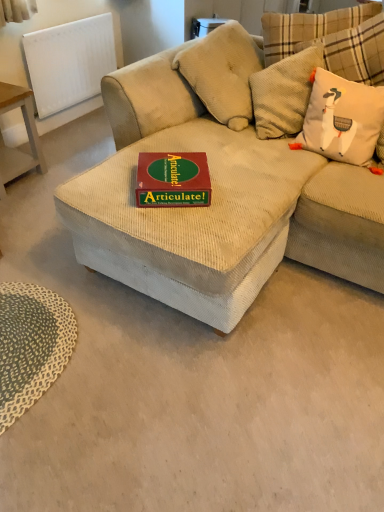
You are a GUI agent. You are given a task and a screenshot of the screen. Output one action in this format:
    pyautogui.click(x=<x>, y=<y>)
    Task: Click on the white textured radiator at upper left
    Image resolution: width=384 pixels, height=512 pixels.
    Given the screenshot: What is the action you would take?
    pyautogui.click(x=69, y=62)

What do you see at coordinates (173, 180) in the screenshot?
I see `green matte board game at center` at bounding box center [173, 180].

Where is `white textured radiator at upper left`? white textured radiator at upper left is located at coordinates (69, 62).

Is white corduroy throw pillow at upper right at the right side of wooden table at left?

Correct, you'll find white corduroy throw pillow at upper right to the right of wooden table at left.

Could you tell me if white corduroy throw pillow at upper right is turned towards wooden table at left?

No, white corduroy throw pillow at upper right is not facing towards wooden table at left.

Considering the relative sizes of white corduroy throw pillow at upper right and wooden table at left in the image provided, is white corduroy throw pillow at upper right wider than wooden table at left?

In fact, white corduroy throw pillow at upper right might be narrower than wooden table at left.

Is white corduroy throw pillow at upper right positioned beyond the bounds of wooden table at left?

Yes.

Looking at this image, from a real-world perspective, which is physically above, green matte board game at center or white textured radiator at upper left?

green matte board game at center, from a real-world perspective.

Which of these two, green matte board game at center or white textured radiator at upper left, is bigger?

white textured radiator at upper left.

Is green matte board game at center turned away from white textured radiator at upper left?

Absolutely, green matte board game at center is directed away from white textured radiator at upper left.

Is white textured radiator at upper left directly adjacent to beige corduroy couch at center?

white textured radiator at upper left and beige corduroy couch at center are clearly separated.

Considering the positions of objects white textured radiator at upper left and beige corduroy couch at center in the image provided, who is more to the right, white textured radiator at upper left or beige corduroy couch at center?

Positioned to the right is beige corduroy couch at center.

Can you confirm if white textured radiator at upper left is thinner than beige corduroy couch at center?

Yes, white textured radiator at upper left is thinner than beige corduroy couch at center.

Who is taller, white textured radiator at upper left or beige corduroy couch at center?

With more height is beige corduroy couch at center.

From a real-world perspective, is green textured mat at lower left over white corduroy throw pillow at upper right?

No, from a real-world perspective, green textured mat at lower left is not above white corduroy throw pillow at upper right.

Is green textured mat at lower left beside white corduroy throw pillow at upper right?

No.

This screenshot has width=384, height=512. What are the coordinates of `throw pillow above the green textured mat at lower left (from a real-world perspective)` in the screenshot? It's located at (342, 119).

Looking at this image, is green textured mat at lower left at the right side of white corduroy throw pillow at upper right?

No.

Is the surface of beige corduroy couch at center in direct contact with green textured mat at lower left?

beige corduroy couch at center and green textured mat at lower left are clearly separated.

Which is correct: beige corduroy couch at center is inside green textured mat at lower left, or outside of it?

The correct answer is: outside.

Does beige corduroy couch at center appear on the right side of green textured mat at lower left?

Correct, you'll find beige corduroy couch at center to the right of green textured mat at lower left.

Does wooden table at left touch green textured mat at lower left?

No, wooden table at left is not with green textured mat at lower left.

Would you say green textured mat at lower left is part of wooden table at left's contents?

No, green textured mat at lower left is not inside wooden table at left.

Is wooden table at left thinner than green textured mat at lower left?

Correct, the width of wooden table at left is less than that of green textured mat at lower left.

In terms of height, does wooden table at left look taller or shorter compared to green textured mat at lower left?

wooden table at left is taller than green textured mat at lower left.

Considering the points (23, 354) and (172, 281), which point is in front, point (23, 354) or point (172, 281)?

Positioned in front is point (172, 281).

From the image's perspective, between green textured mat at lower left and beige corduroy couch at center, who is located below?

From the image's view, green textured mat at lower left is below.

From the picture: Would you say green textured mat at lower left is outside beige corduroy couch at center?

green textured mat at lower left lies outside beige corduroy couch at center's area.

From a real-world perspective, does green textured mat at lower left sit lower than beige corduroy couch at center?

Yes, from a real-world perspective, green textured mat at lower left is below beige corduroy couch at center.

You are a GUI agent. You are given a task and a screenshot of the screen. Output one action in this format:
    pyautogui.click(x=<x>, y=<y>)
    Task: Click on the throw pillow located above the wooden table at left (from a real-world perspective)
    The height and width of the screenshot is (512, 384).
    Given the screenshot: What is the action you would take?
    pyautogui.click(x=342, y=119)

Identify the location of radiator lying on the left of green matte board game at center. (69, 62).

Which object lies nearer to the anchor point beige corduroy couch at center, green matte board game at center or green textured mat at lower left?

green matte board game at center lies closer to beige corduroy couch at center than the other object.

Based on their spatial positions, is green matte board game at center or wooden table at left further from green textured mat at lower left?

Result: The object further to green textured mat at lower left is wooden table at left.

When comparing their distances from beige corduroy couch at center, does white textured radiator at upper left or green matte board game at center seem further?

white textured radiator at upper left.

Based on their spatial positions, is white textured radiator at upper left or beige corduroy couch at center further from green textured mat at lower left?

white textured radiator at upper left.

When comparing their distances from white textured radiator at upper left, does green textured mat at lower left or green matte board game at center seem further?

green textured mat at lower left.

Based on their spatial positions, is wooden table at left or green matte board game at center closer to white textured radiator at upper left?

wooden table at left.

When comparing their distances from green textured mat at lower left, does white textured radiator at upper left or white corduroy throw pillow at upper right seem closer?

white corduroy throw pillow at upper right.

Estimate the real-world distances between objects in this image. Which object is closer to white corduroy throw pillow at upper right, green matte board game at center or wooden table at left?

green matte board game at center.

At what (x,y) coordinates should I click in order to perform the action: click on mat situated between wooden table at left and beige corduroy couch at center from left to right. Please return your answer as a coordinate pair (x, y). This screenshot has height=512, width=384. Looking at the image, I should click on (31, 345).

Image resolution: width=384 pixels, height=512 pixels. Identify the location of paperback book between beige corduroy couch at center and white textured radiator at upper left in the front-back direction. point(173,180).

Locate an element on the screen. This screenshot has height=512, width=384. throw pillow between beige corduroy couch at center and white textured radiator at upper left from front to back is located at coordinates (342, 119).

Where is `mat between beige corduroy couch at center and white textured radiator at upper left along the z-axis`? This screenshot has height=512, width=384. mat between beige corduroy couch at center and white textured radiator at upper left along the z-axis is located at coordinates (31, 345).